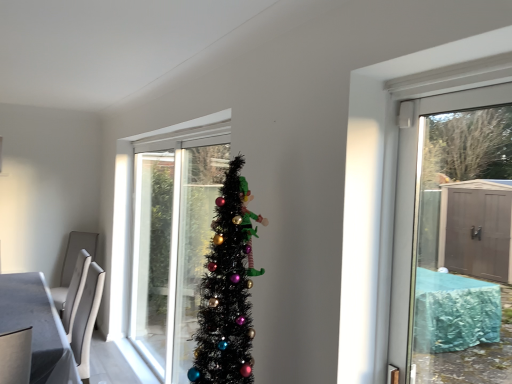
Identify the location of free space above white glossy table at lower left (from a real-world perspective). This screenshot has height=384, width=512. click(x=27, y=305).